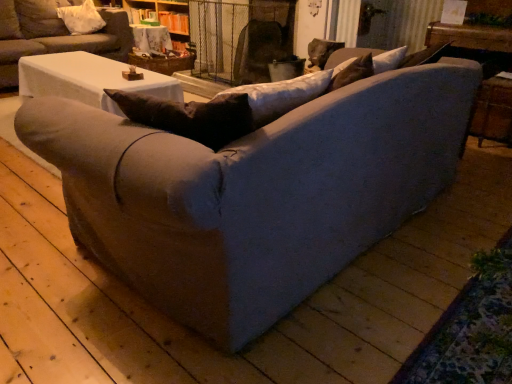
Question: In which direction should I rotate to look at textured gray couch at center, which is the first studio couch in bottom-to-top order?

Choices:
 (A) left
 (B) right

Answer: (A)

Question: Is matte gray couch at center, the 1th studio couch from the top, outside white fabric pillow at upper left?

Choices:
 (A) no
 (B) yes

Answer: (B)

Question: From a real-world perspective, is matte gray couch at center, the 1th studio couch from the top, on white fabric pillow at upper left?

Choices:
 (A) no
 (B) yes

Answer: (A)

Question: Is matte gray couch at center, the 1th studio couch from the top, not close to white fabric pillow at upper left?

Choices:
 (A) no
 (B) yes

Answer: (A)

Question: Would you say white fabric pillow at upper left is part of matte gray couch at center, arranged as the second studio couch when ordered from the bottom,'s contents?

Choices:
 (A) yes
 (B) no

Answer: (A)

Question: Is matte gray couch at center, arranged as the second studio couch when ordered from the bottom, wider than white fabric pillow at upper left?

Choices:
 (A) yes
 (B) no

Answer: (A)

Question: Is matte gray couch at center, the 1th studio couch from the top, taller than white fabric pillow at upper left?

Choices:
 (A) no
 (B) yes

Answer: (B)

Question: Considering the relative sizes of wooden textured table at upper center and white fabric pillow at upper left in the image provided, is wooden textured table at upper center bigger than white fabric pillow at upper left?

Choices:
 (A) yes
 (B) no

Answer: (A)

Question: From the image's perspective, would you say wooden textured table at upper center is shown under white fabric pillow at upper left?

Choices:
 (A) yes
 (B) no

Answer: (A)

Question: Is wooden textured table at upper center positioned beyond the bounds of white fabric pillow at upper left?

Choices:
 (A) yes
 (B) no

Answer: (A)

Question: From the image's perspective, is wooden textured table at upper center on top of white fabric pillow at upper left?

Choices:
 (A) yes
 (B) no

Answer: (B)

Question: Is wooden textured table at upper center taller than white fabric pillow at upper left?

Choices:
 (A) no
 (B) yes

Answer: (A)

Question: Would you say wooden textured table at upper center is a long distance from white fabric pillow at upper left?

Choices:
 (A) yes
 (B) no

Answer: (B)

Question: Is white fabric pillow at upper left closer to camera compared to matte gray couch at center, the 1th studio couch from the top?

Choices:
 (A) yes
 (B) no

Answer: (B)